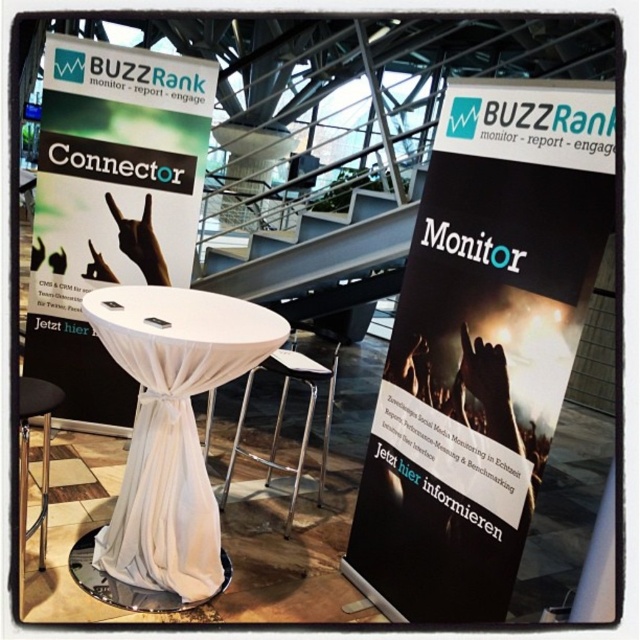
The height and width of the screenshot is (640, 640). Describe the element at coordinates (483, 344) in the screenshot. I see `black paper poster at center` at that location.

Based on the photo, measure the distance from black paper poster at center to black metal stool at lower left.

5.07 feet

What do you see at coordinates (483, 344) in the screenshot?
I see `black paper poster at center` at bounding box center [483, 344].

This screenshot has height=640, width=640. Find the location of `black paper poster at center`. black paper poster at center is located at coordinates (483, 344).

Consider the image. Between white cloth-covered table at center and black metal stool at lower left, which one is positioned higher?

white cloth-covered table at center

Who is more distant from viewer, [252,360] or [20,458]?

Positioned behind is point [252,360].

At what (x,y) coordinates should I click in order to perform the action: click on white cloth-covered table at center. Please return your answer as a coordinate pair (x, y). Image resolution: width=640 pixels, height=640 pixels. Looking at the image, I should click on (172, 426).

Who is shorter, black paper poster at center or metallic silver stool at center?

metallic silver stool at center

Identify the location of black paper poster at center. (483, 344).